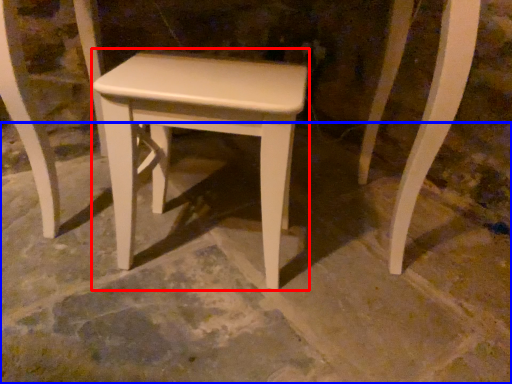
Question: Which object is further to the camera taking this photo, stool (highlighted by a red box) or concrete (highlighted by a blue box)?

Choices:
 (A) stool
 (B) concrete

Answer: (A)